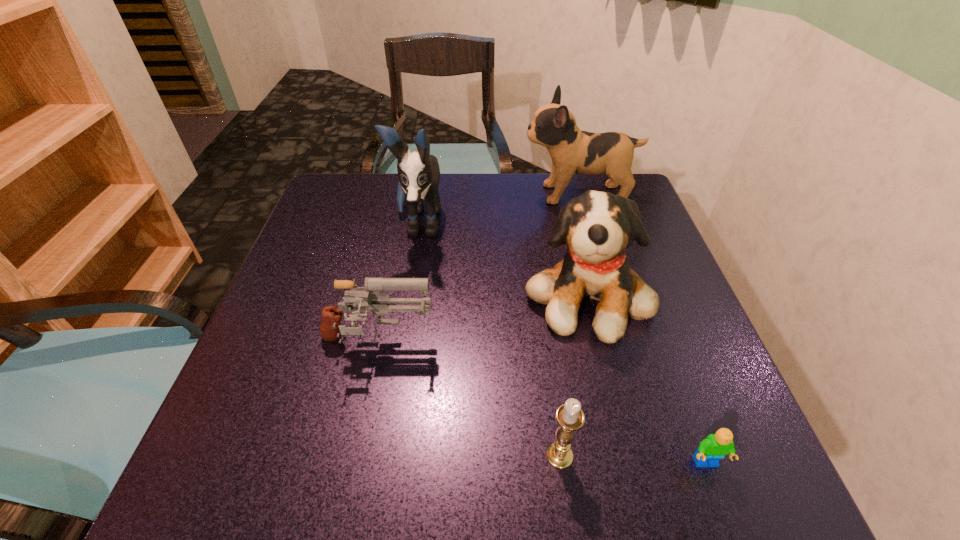
Identify the location of Lego present at the near edge. The width and height of the screenshot is (960, 540). (713, 448).

Identify the location of object that is at the left edge. (369, 299).

I want to click on Lego that is at the right edge, so click(x=713, y=448).

Locate an element on the screen. This screenshot has height=540, width=960. object located in the far right corner section of the desktop is located at coordinates (572, 151).

Locate an element on the screen. The image size is (960, 540). object situated at the near right corner is located at coordinates (713, 448).

This screenshot has width=960, height=540. I want to click on vacant space at the far edge of the desktop, so click(x=569, y=185).

In the image, there is a desktop. At what (x,y) coordinates should I click in order to perform the action: click on free region at the near edge. Please return your answer as a coordinate pair (x, y). This screenshot has height=540, width=960. Looking at the image, I should click on (444, 478).

Find the location of a particular element. vacant area at the left edge is located at coordinates (315, 402).

Locate an element on the screen. The width and height of the screenshot is (960, 540). blank area at the right edge is located at coordinates (736, 414).

Identify the location of vacant area at the far left corner of the desktop. (362, 218).